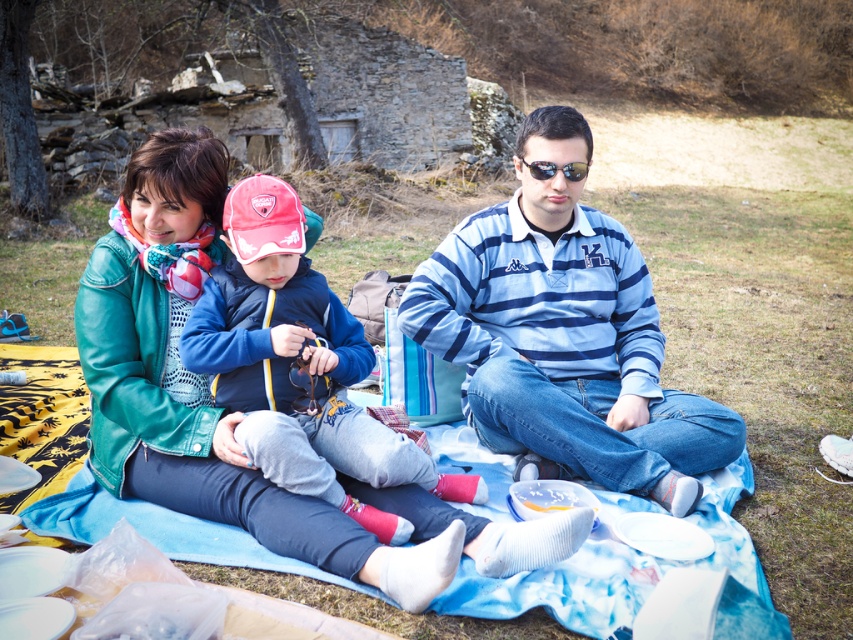
You are a photographer trying to capture a candid shot of the family. You want to ensure that both the blue striped jersey at center and the sunglasses at center are in focus. Given that your camera can only focus on objects within a 15 inch range, will both items be in focus?

The blue striped jersey at center is 20.87 inches from sunglasses at center. Since the distance between them exceeds the 15 inch focus range, they cannot both be in focus at the same time.

You are planning to pack for a picnic and see both the blue striped jersey at center and the blue fleece jacket at center. Which one should you choose if you want to bring the larger item?

The blue striped jersey at center is bigger than the blue fleece jacket at center, so you should choose the blue striped jersey at center.